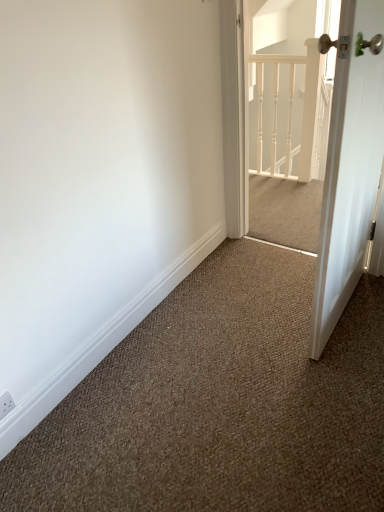
Image resolution: width=384 pixels, height=512 pixels. Find the location of `white glossy door at right`. white glossy door at right is located at coordinates coord(349,170).

Where is `white textured screen door at upper right`? The image size is (384, 512). white textured screen door at upper right is located at coordinates (291, 124).

Where is `screen door located underneath the white glossy door at right (from a real-world perspective)`? screen door located underneath the white glossy door at right (from a real-world perspective) is located at coordinates (291, 124).

Is white glossy door at right in front of white textured screen door at upper right?

Yes, it is.

Can you confirm if white glossy door at right is thinner than white textured screen door at upper right?

Yes, white glossy door at right is thinner than white textured screen door at upper right.

Is white glossy door at right taller than white textured screen door at upper right?

Correct, white glossy door at right is much taller as white textured screen door at upper right.

Is white painted wood railing at upper center inside the boundaries of white textured screen door at upper right, or outside?

white painted wood railing at upper center is not inside white textured screen door at upper right, it's outside.

The height and width of the screenshot is (512, 384). Find the location of `rail located on the right of white textured screen door at upper right`. rail located on the right of white textured screen door at upper right is located at coordinates (304, 98).

Is point (309, 151) farther from viewer compared to point (270, 149)?

No.

Which object is further away from the camera taking this photo, white painted wood railing at upper center or white textured screen door at upper right?

white painted wood railing at upper center.

In terms of width, does white textured screen door at upper right look wider or thinner when compared to white glossy door at right?

Clearly, white textured screen door at upper right has more width compared to white glossy door at right.

How many degrees apart are the facing directions of white textured screen door at upper right and white glossy door at right?

They differ by 89.2 degrees in their facing directions.

Is the surface of white textured screen door at upper right in direct contact with white glossy door at right?

No, white textured screen door at upper right is not making contact with white glossy door at right.

Considering the relative sizes of white textured screen door at upper right and white glossy door at right in the image provided, is white textured screen door at upper right bigger than white glossy door at right?

No, white textured screen door at upper right is not bigger than white glossy door at right.

Could you tell me if white glossy door at right is turned towards white painted wood railing at upper center?

No, white glossy door at right is not oriented towards white painted wood railing at upper center.

Which is closer, (367, 74) or (275, 55)?

Point (367, 74) is positioned closer to the camera compared to point (275, 55).

From the image's perspective, between white glossy door at right and white painted wood railing at upper center, who is located below?

white glossy door at right appears lower in the image.

Would you consider white glossy door at right to be distant from white painted wood railing at upper center?

Yes, white glossy door at right and white painted wood railing at upper center are located far from each other.

Is white painted wood railing at upper center far from white glossy door at right?

white painted wood railing at upper center is far away from white glossy door at right.

Which of these two, white painted wood railing at upper center or white glossy door at right, is wider?

Wider between the two is white glossy door at right.

Is point (269, 108) more distant than point (313, 55)?

That is False.

Based on their positions, is white textured screen door at upper right located to the left or right of white painted wood railing at upper center?

white textured screen door at upper right is to the left of white painted wood railing at upper center.

The image size is (384, 512). What are the coordinates of `screen door in front of the white painted wood railing at upper center` in the screenshot? It's located at (291, 124).

At what (x,y) coordinates should I click in order to perform the action: click on screen door below the white glossy door at right (from a real-world perspective). Please return your answer as a coordinate pair (x, y). This screenshot has width=384, height=512. Looking at the image, I should click on (291, 124).

You are a GUI agent. You are given a task and a screenshot of the screen. Output one action in this format:
    pyautogui.click(x=<x>, y=<y>)
    Task: Click on the screen door that appears in front of the white painted wood railing at upper center
    This screenshot has width=384, height=512.
    Given the screenshot: What is the action you would take?
    pyautogui.click(x=291, y=124)

Which object lies further to the anchor point white glossy door at right, white painted wood railing at upper center or white textured screen door at upper right?

white painted wood railing at upper center is positioned further to the anchor white glossy door at right.

Estimate the real-world distances between objects in this image. Which object is closer to white painted wood railing at upper center, white textured screen door at upper right or white glossy door at right?

Based on the image, white textured screen door at upper right appears to be nearer to white painted wood railing at upper center.

Which object lies nearer to the anchor point white painted wood railing at upper center, white glossy door at right or white textured screen door at upper right?

The object closer to white painted wood railing at upper center is white textured screen door at upper right.

In the scene shown: Which object lies nearer to the anchor point white textured screen door at upper right, white glossy door at right or white painted wood railing at upper center?

The object closer to white textured screen door at upper right is white painted wood railing at upper center.

Considering their positions, is white painted wood railing at upper center positioned further to white textured screen door at upper right than white glossy door at right?

white glossy door at right is further to white textured screen door at upper right.

Looking at the image, which one is located further to white glossy door at right, white textured screen door at upper right or white painted wood railing at upper center?

white painted wood railing at upper center lies further to white glossy door at right than the other object.

At what (x,y) coordinates should I click in order to perform the action: click on screen door between white glossy door at right and white painted wood railing at upper center along the z-axis. Please return your answer as a coordinate pair (x, y). This screenshot has height=512, width=384. Looking at the image, I should click on (291, 124).